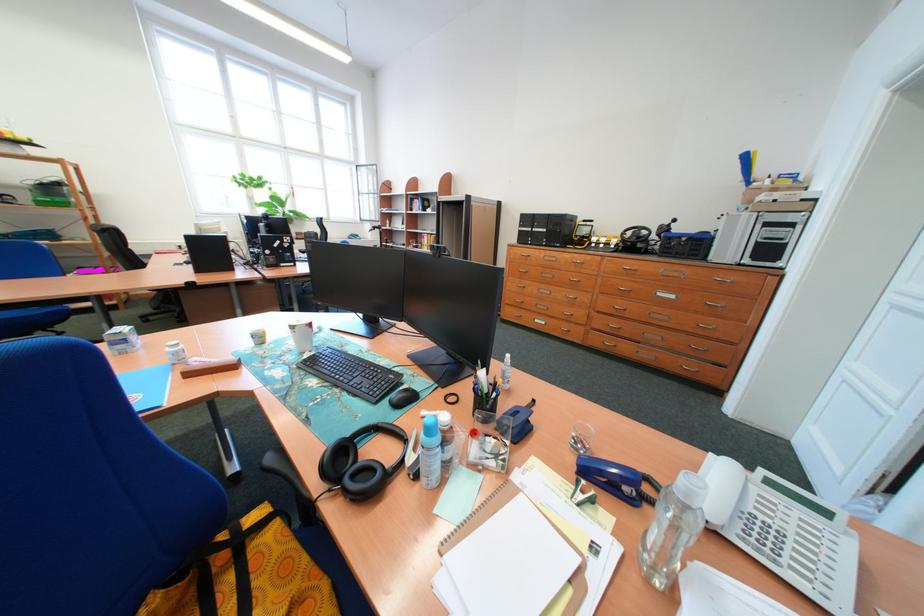
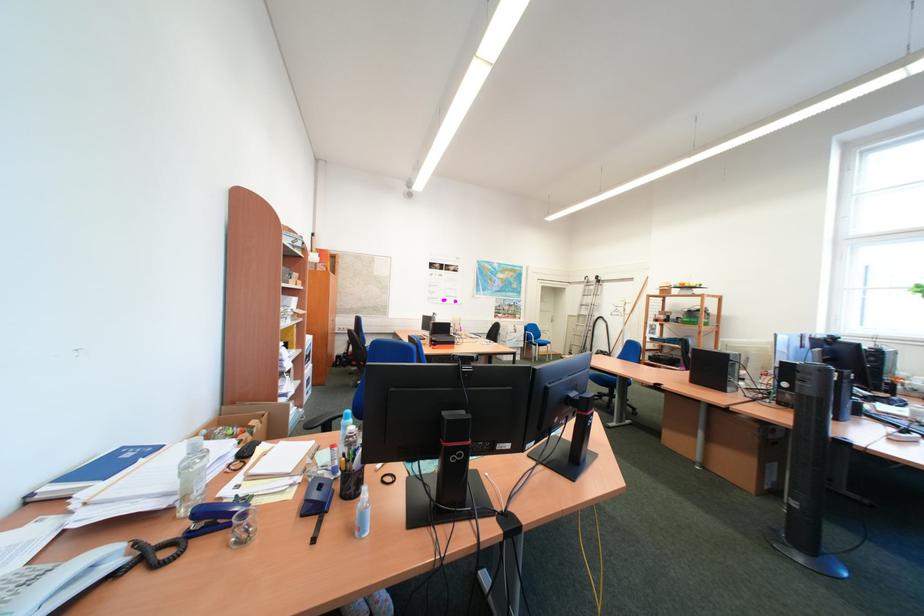
In the second image, find the point that corresponds to point (282, 254) in the first image.

(798, 387)